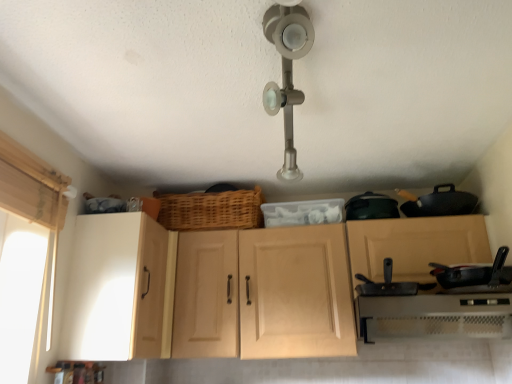
Question: Based on their sizes in the image, would you say white matte cabinet at left, which is the 1th cabinetry from left to right, is bigger or smaller than white plastic oven at lower right?

Choices:
 (A) small
 (B) big

Answer: (B)

Question: Choose the correct answer: Is white matte cabinet at left, marked as the 2th cabinetry in a right-to-left arrangement, inside white plastic oven at lower right or outside it?

Choices:
 (A) inside
 (B) outside

Answer: (B)

Question: Which is nearer to the woven wood basket at center?

Choices:
 (A) satin nickel light fixture at upper center
 (B) white matte cabinet at left, marked as the 2th cabinetry in a right-to-left arrangement
 (C) matte wood cabinet at center, placed as the first cabinetry when sorted from right to left
 (D) black matte frying pan at center, which ranks as the first frying pan in left-to-right order
 (E) white plastic oven at lower right

Answer: (C)

Question: Which object is the closest to the white plastic oven at lower right?

Choices:
 (A) black matte frying pan at center, which ranks as the first frying pan in left-to-right order
 (B) satin nickel light fixture at upper center
 (C) white matte cabinet at left, marked as the 2th cabinetry in a right-to-left arrangement
 (D) woven wood basket at center
 (E) white fabric at left

Answer: (A)